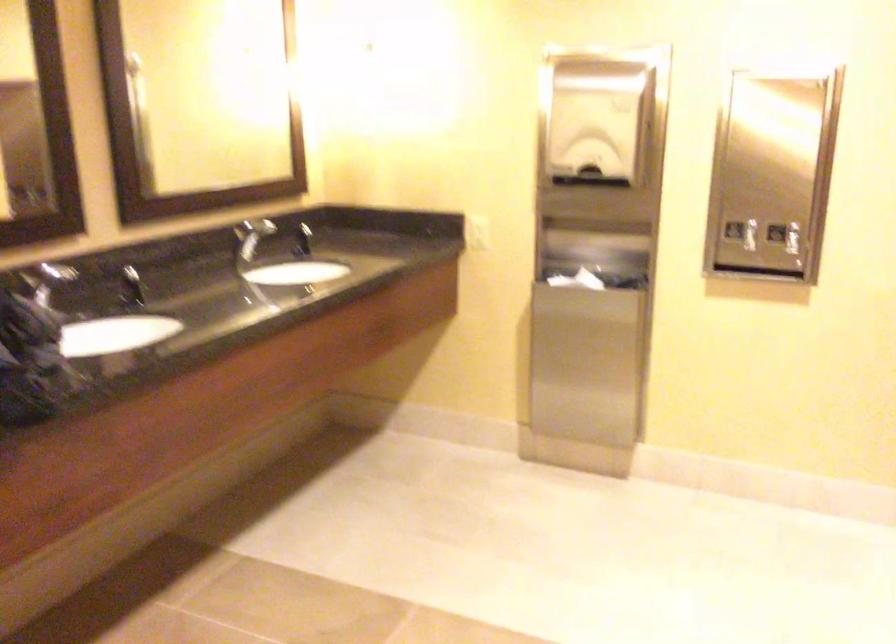
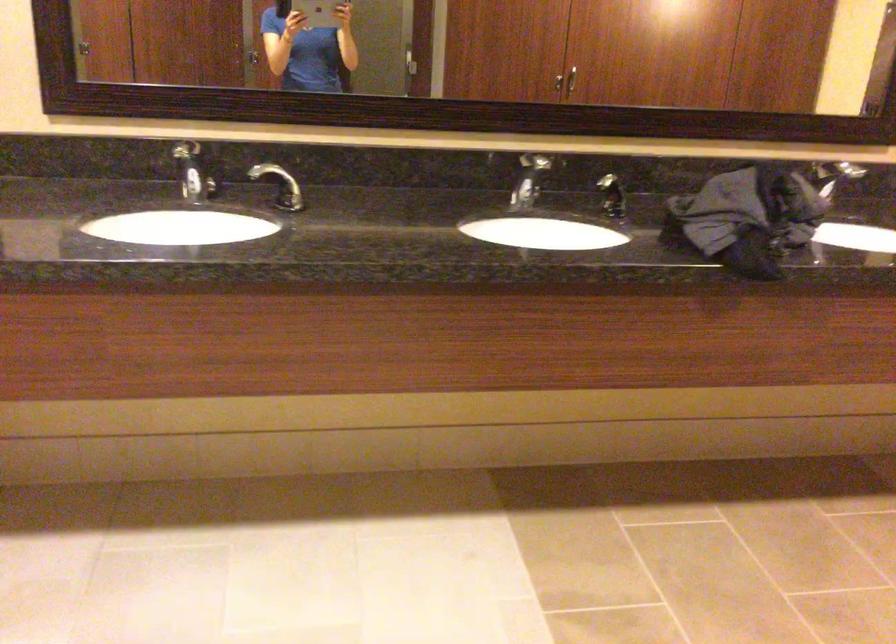
Question: The camera is either moving clockwise (left) or counter-clockwise (right) around the object. The first image is from the beginning of the video and the second image is from the end. Is the camera moving left or right when shooting the video?

Choices:
 (A) Left
 (B) Right

Answer: (B)